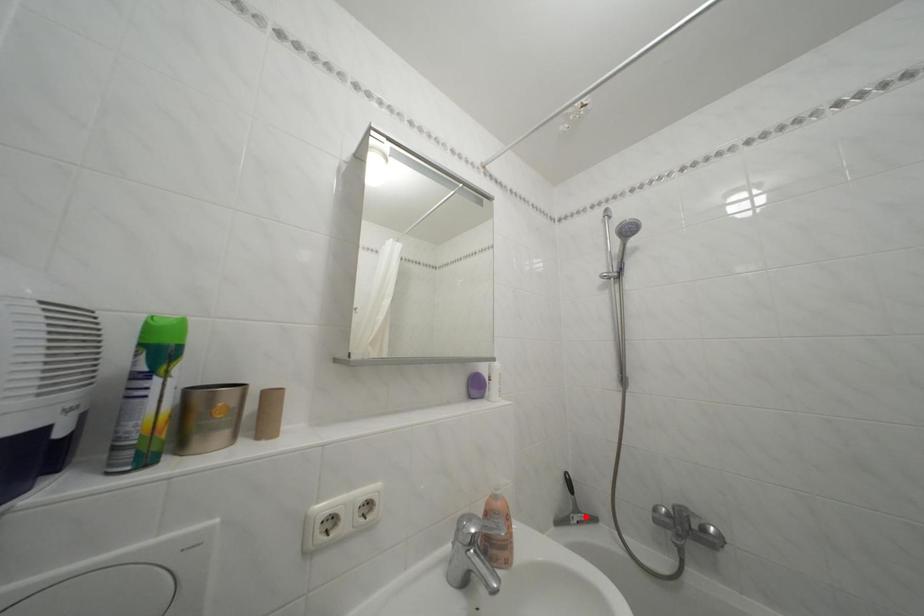
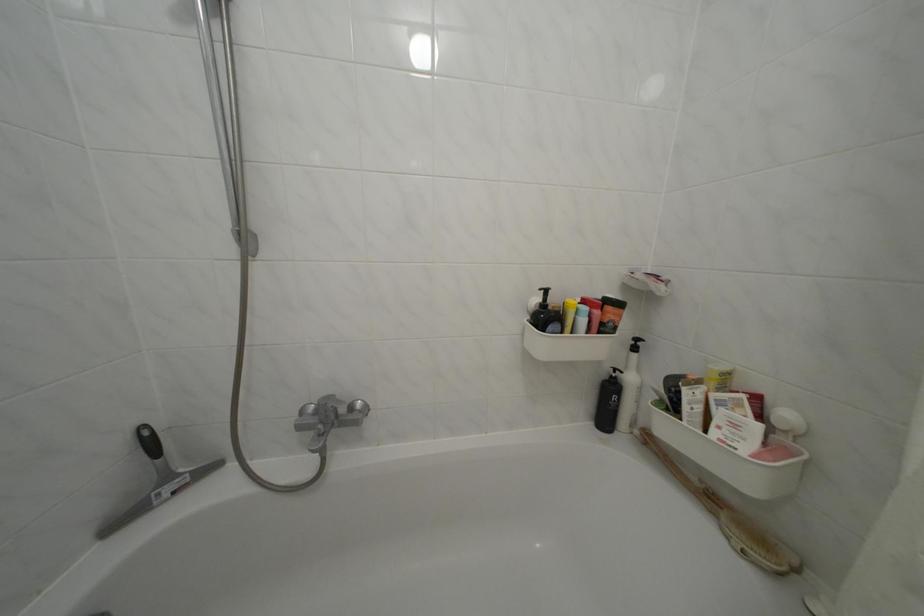
Locate, in the second image, the point that corresponds to the highlighted location in the first image.

(176, 484)